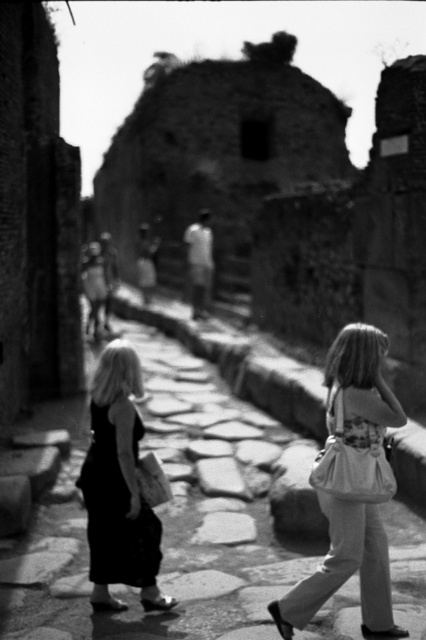
You are standing at the starting point of the cobblestone pathway in the ancient Roman ruin scene. There is a pebble stone pavement at center marked by point (169, 512). If you want to reach the partially ruined building in the background, should you walk towards or away from this point?

You should walk towards the pebble stone pavement at center marked by point (169, 512) because the pathway leads towards the partially ruined building in the background.

You are standing at the camera position in the image and want to walk towards the pebble stone pavement at center. According to the coordinates provided, in which direction should you move relative to your current position?

The pebble stone pavement at center is located at coordinates point (169, 512). Since the x and y coordinates are both greater than 0.5, you should move forward and to the right to reach it.